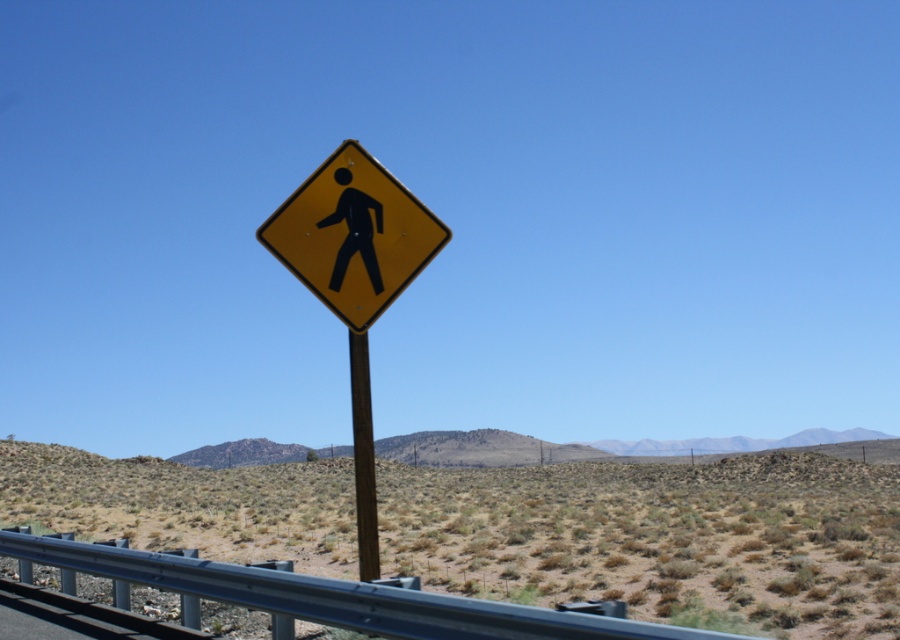
Does point (887, 634) lie in front of point (364, 234)?

No, (887, 634) is behind (364, 234).

Can you confirm if dried grass at center is positioned to the right of yellow plastic pedestrian sign at center?

Indeed, dried grass at center is positioned on the right side of yellow plastic pedestrian sign at center.

Which is in front, point (867, 577) or point (338, 211)?

Point (338, 211) is more forward.

Image resolution: width=900 pixels, height=640 pixels. I want to click on dried grass at center, so click(662, 538).

Is point (300, 250) in front of point (356, 452)?

No, (300, 250) is behind (356, 452).

Is point (397, 184) behind point (360, 348)?

Yes, point (397, 184) is behind point (360, 348).

Is point (415, 243) closer to viewer compared to point (374, 515)?

That is False.

Image resolution: width=900 pixels, height=640 pixels. Find the location of `yellow matte pedestrian sign at center`. yellow matte pedestrian sign at center is located at coordinates (353, 236).

Who is lower down, dried grass at center or yellow matte pedestrian sign at center?

Positioned lower is dried grass at center.

The image size is (900, 640). What do you see at coordinates (662, 538) in the screenshot?
I see `dried grass at center` at bounding box center [662, 538].

Who is more forward, (142, 520) or (382, 227)?

Point (382, 227) is more forward.

This screenshot has width=900, height=640. In order to click on dried grass at center in this screenshot , I will do click(x=662, y=538).